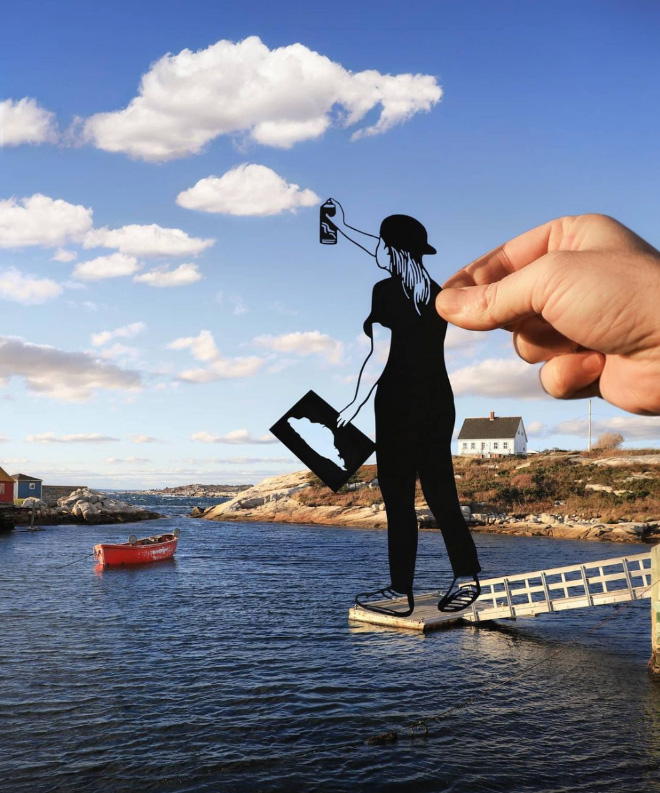
Where is `diagonal white staircase`? diagonal white staircase is located at coordinates (574, 600).